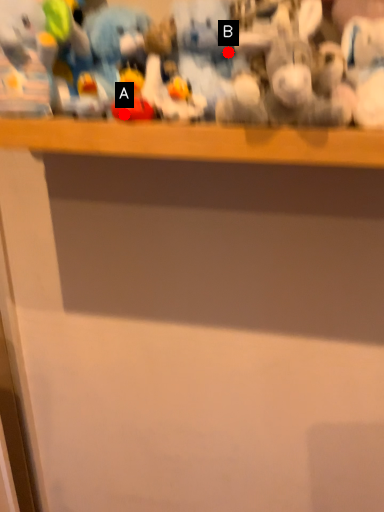
Question: Two points are circled on the image, labeled by A and B beside each circle. Among these points, which one is farthest from the camera?

Choices:
 (A) A is further
 (B) B is further

Answer: (B)